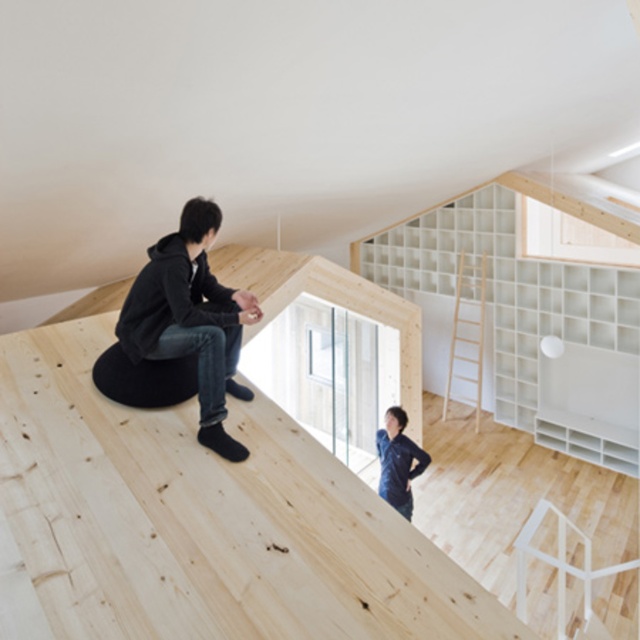
Is black matte bean bag at upper left taller than dark blue fabric at upper center?

Yes, black matte bean bag at upper left is taller than dark blue fabric at upper center.

From the picture: Is black matte bean bag at upper left to the left of dark blue fabric at upper center from the viewer's perspective?

Yes, black matte bean bag at upper left is to the left of dark blue fabric at upper center.

Which is behind, point (188, 288) or point (387, 484)?

The point (387, 484) is more distant.

Find the location of a particular element. This screenshot has height=640, width=640. black matte bean bag at upper left is located at coordinates (192, 320).